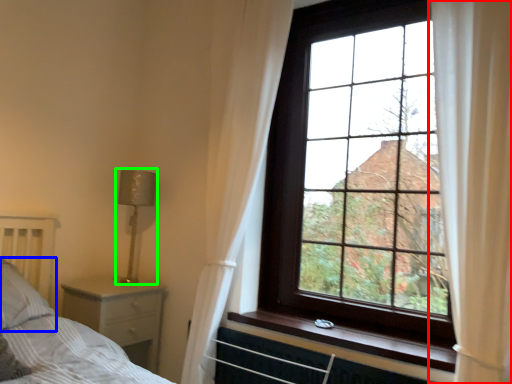
Question: Which is nearer to the curtain (highlighted by a red box)? pillow (highlighted by a blue box) or lamp (highlighted by a green box).

Choices:
 (A) pillow
 (B) lamp

Answer: (B)